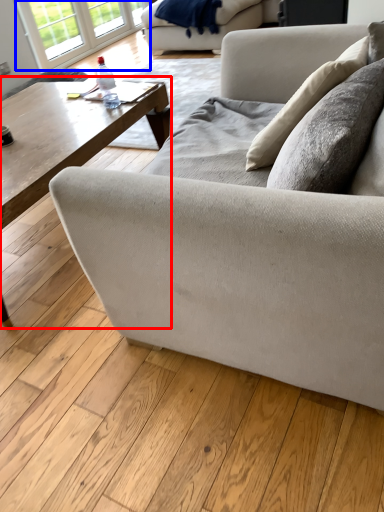
Question: Which object appears farthest to the camera in this image, coffee table (highlighted by a red box) or window (highlighted by a blue box)?

Choices:
 (A) coffee table
 (B) window

Answer: (B)